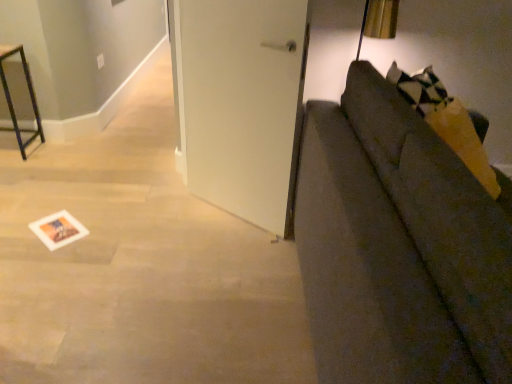
The width and height of the screenshot is (512, 384). What are the coordinates of `free space above white paper postcard at lower left (from a real-world perspective)` in the screenshot? It's located at (59, 228).